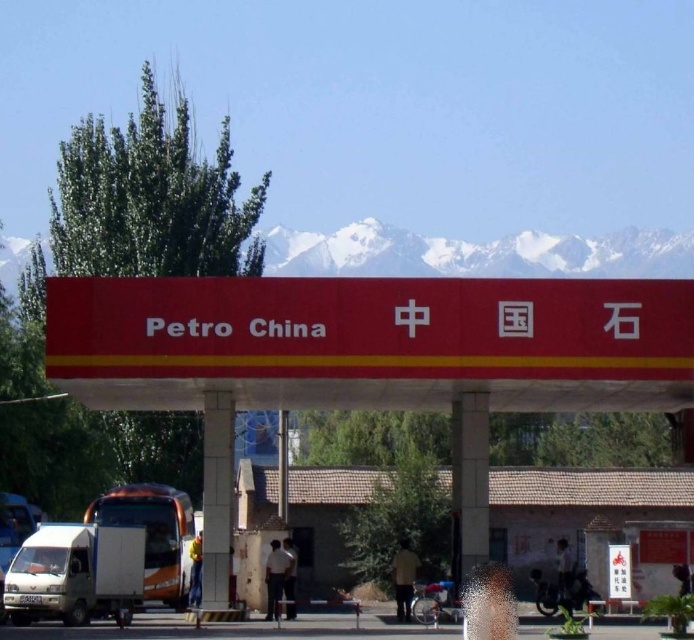
Which is above, red matte petro china sign at center or orange metallic truck at center?

red matte petro china sign at center is higher up.

Who is lower down, red matte petro china sign at center or orange metallic truck at center?

orange metallic truck at center is below.

Does point (226, 417) come behind point (162, 570)?

No.

Find the location of a particular element. The width and height of the screenshot is (694, 640). red matte petro china sign at center is located at coordinates (369, 360).

Who is more distant from viewer, (668, 289) or (28, 618)?

The point (28, 618) is behind.

Does point (672, 337) come behind point (56, 572)?

That is False.

Where is `red matte petro china sign at center`? The width and height of the screenshot is (694, 640). red matte petro china sign at center is located at coordinates (369, 360).

Is red matte petro china sign at center smaller than white matte van at lower left?

Incorrect, red matte petro china sign at center is not smaller in size than white matte van at lower left.

Image resolution: width=694 pixels, height=640 pixels. In order to click on red matte petro china sign at center in this screenshot , I will do `click(369, 360)`.

Between point (423, 288) and point (8, 512), which one is positioned in front?

Point (423, 288) is in front.

This screenshot has height=640, width=694. Identify the location of red matte petro china sign at center. (369, 360).